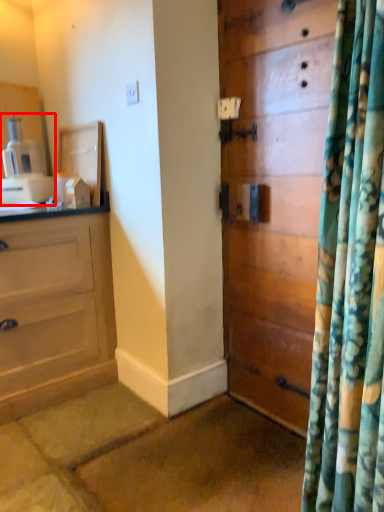
Question: Considering the relative positions of coffee machine (annotated by the red box) and door in the image provided, where is coffee machine (annotated by the red box) located with respect to the staircase?

Choices:
 (A) right
 (B) left

Answer: (B)